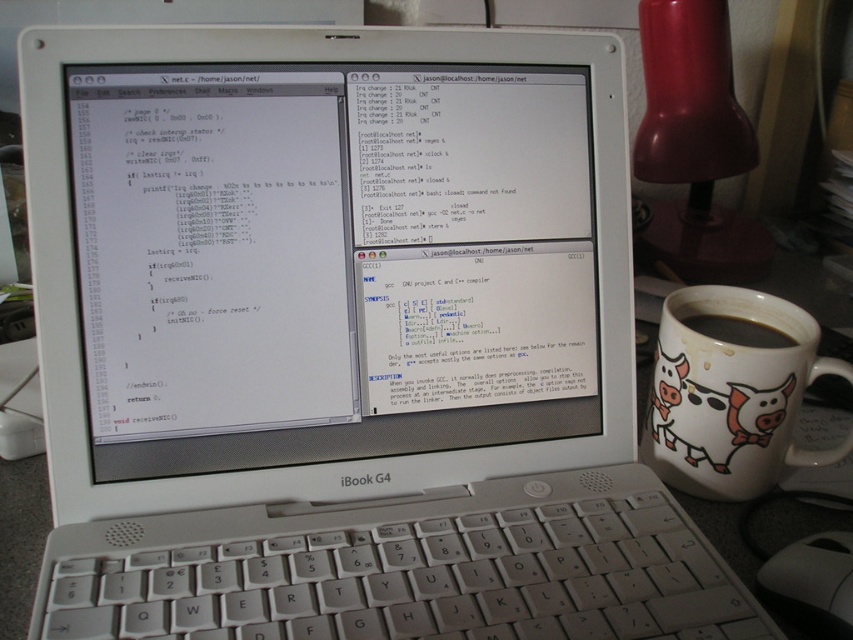
Question: Among these points, which one is farthest from the camera?

Choices:
 (A) (834, 576)
 (B) (270, 108)
 (C) (668, 449)

Answer: (C)

Question: Is white ceramic mug at right to the left of white plastic mouse at lower right from the viewer's perspective?

Choices:
 (A) yes
 (B) no

Answer: (B)

Question: Is white ceramic mug at right below black matte mug at right?

Choices:
 (A) no
 (B) yes

Answer: (B)

Question: Is white plastic keyboard at center closer to camera compared to white plastic mouse at lower right?

Choices:
 (A) yes
 (B) no

Answer: (A)

Question: Among these objects, which one is farthest from the camera?

Choices:
 (A) black matte mug at right
 (B) white plastic keyboard at center
 (C) white glossy computer screen at center

Answer: (A)

Question: Among these objects, which one is nearest to the camera?

Choices:
 (A) white glossy computer screen at center
 (B) black matte mug at right
 (C) white ceramic mug at right
 (D) white plastic keyboard at center

Answer: (D)